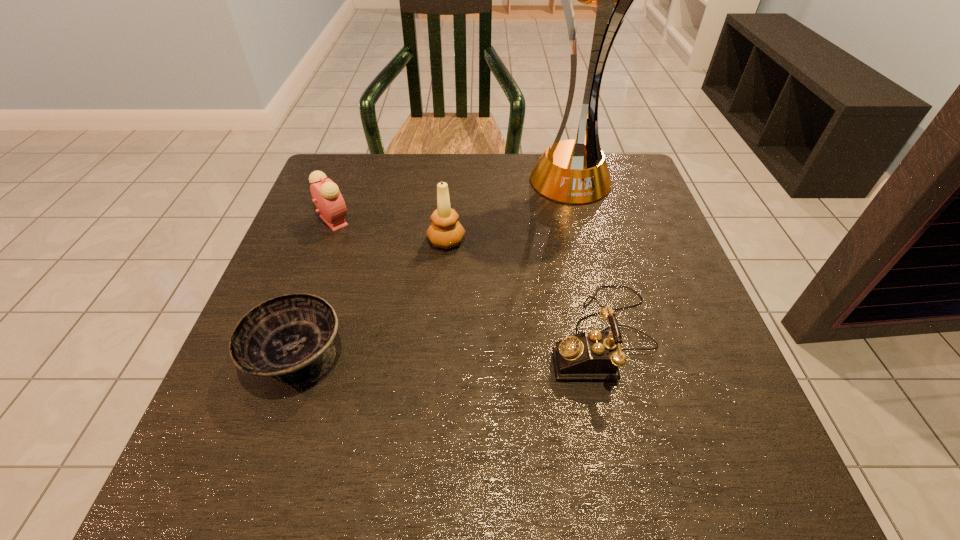
Where is `vacant region that satisfies the following two spatial constraints: 1. on the face of the alarm clock; 2. on the left side of the fourth shortest object`? This screenshot has height=540, width=960. vacant region that satisfies the following two spatial constraints: 1. on the face of the alarm clock; 2. on the left side of the fourth shortest object is located at coordinates (326, 241).

Where is `vacant space that satisfies the following two spatial constraints: 1. on the face of the alarm clock; 2. on the back side of the bowl`? This screenshot has width=960, height=540. vacant space that satisfies the following two spatial constraints: 1. on the face of the alarm clock; 2. on the back side of the bowl is located at coordinates click(x=284, y=357).

Locate an element on the screen. The height and width of the screenshot is (540, 960). free region that satisfies the following two spatial constraints: 1. on the front-facing side of the farthest object; 2. on the face of the alarm clock is located at coordinates (579, 220).

Locate an element on the screen. free space that satisfies the following two spatial constraints: 1. on the face of the shortest object; 2. on the left side of the alarm clock is located at coordinates (284, 357).

What are the coordinates of `free location that satisfies the following two spatial constraints: 1. on the face of the shortest object; 2. on the left side of the alarm clock` in the screenshot? It's located at (284, 357).

Find the location of a particular element. The height and width of the screenshot is (540, 960). blank space that satisfies the following two spatial constraints: 1. on the back side of the fourth shortest object; 2. on the face of the alarm clock is located at coordinates (448, 220).